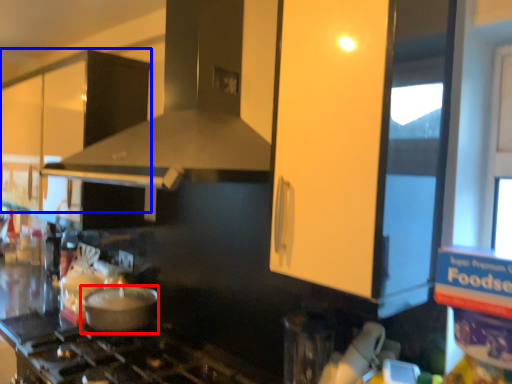
Question: Which object appears farthest to the camera in this image, kitchen appliance (highlighted by a red box) or cabinetry (highlighted by a blue box)?

Choices:
 (A) kitchen appliance
 (B) cabinetry

Answer: (B)